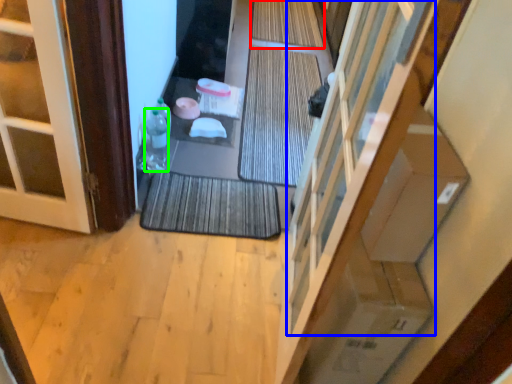
Question: Which object is the closest to the bath mat (highlighted by a red box)? Choose among these: window (highlighted by a blue box) or bottle (highlighted by a green box).

Choices:
 (A) window
 (B) bottle

Answer: (B)